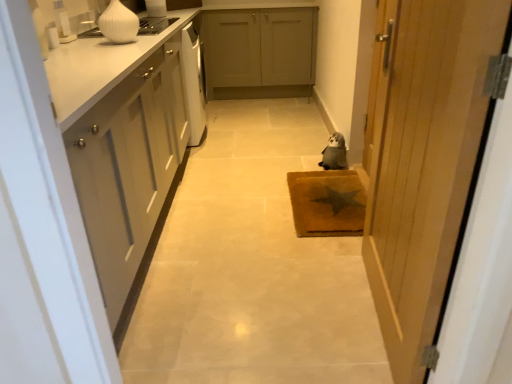
Question: Is matte gray cabinets at center, marked as the 1th cabinetry in a back-to-front arrangement, to the left of white matte cabinet at left, the 2th cabinetry when ordered from right to left, from the viewer's perspective?

Choices:
 (A) yes
 (B) no

Answer: (B)

Question: Is matte gray cabinets at center, which ranks as the second cabinetry in bottom-to-top order, facing towards white matte cabinet at left, the 2th cabinetry viewed from the back?

Choices:
 (A) no
 (B) yes

Answer: (B)

Question: Considering the relative sizes of matte gray cabinets at center, placed as the 2th cabinetry when sorted from front to back, and white matte cabinet at left, marked as the 1th cabinetry in a bottom-to-top arrangement, in the image provided, is matte gray cabinets at center, placed as the 2th cabinetry when sorted from front to back, taller than white matte cabinet at left, marked as the 1th cabinetry in a bottom-to-top arrangement,?

Choices:
 (A) no
 (B) yes

Answer: (A)

Question: From a real-world perspective, is matte gray cabinets at center, positioned as the first cabinetry in right-to-left order, beneath white matte cabinet at left, the 1th cabinetry positioned from the front?

Choices:
 (A) no
 (B) yes

Answer: (B)

Question: Is matte gray cabinets at center, placed as the 2th cabinetry when sorted from front to back, further to camera compared to white matte cabinet at left, marked as the 1th cabinetry in a bottom-to-top arrangement?

Choices:
 (A) yes
 (B) no

Answer: (A)

Question: In terms of height, does wooden door at right look taller or shorter compared to brown textured mat at center?

Choices:
 (A) tall
 (B) short

Answer: (A)

Question: Is wooden door at right to the left or to the right of brown textured mat at center in the image?

Choices:
 (A) left
 (B) right

Answer: (B)

Question: From the image's perspective, relative to brown textured mat at center, is wooden door at right above or below?

Choices:
 (A) below
 (B) above

Answer: (B)

Question: From a real-world perspective, is wooden door at right physically located above or below brown textured mat at center?

Choices:
 (A) below
 (B) above

Answer: (B)

Question: From the image's perspective, is wooden door at right located above or below fuzzy gray stuffed animal at center?

Choices:
 (A) below
 (B) above

Answer: (A)

Question: Is wooden door at right inside or outside of fuzzy gray stuffed animal at center?

Choices:
 (A) outside
 (B) inside

Answer: (A)

Question: In terms of width, does wooden door at right look wider or thinner when compared to fuzzy gray stuffed animal at center?

Choices:
 (A) wide
 (B) thin

Answer: (B)

Question: Is wooden door at right bigger or smaller than fuzzy gray stuffed animal at center?

Choices:
 (A) small
 (B) big

Answer: (B)

Question: Is fuzzy gray stuffed animal at center taller or shorter than matte gray cabinets at center, marked as the 1th cabinetry in a back-to-front arrangement?

Choices:
 (A) tall
 (B) short

Answer: (B)

Question: Is fuzzy gray stuffed animal at center inside or outside of matte gray cabinets at center, which ranks as the second cabinetry in left-to-right order?

Choices:
 (A) inside
 (B) outside

Answer: (B)